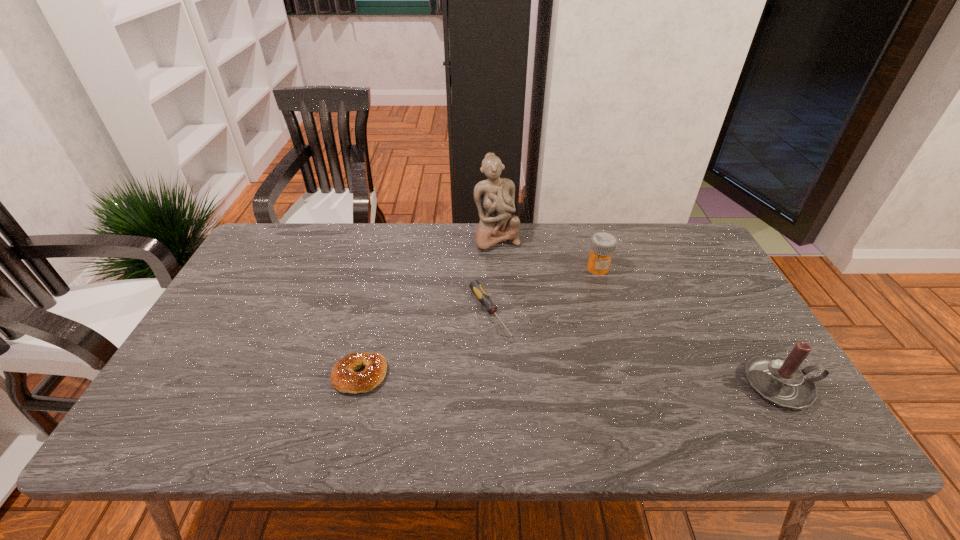
You are a GUI agent. You are given a task and a screenshot of the screen. Output one action in this format:
    pyautogui.click(x=<x>, y=<y>)
    Task: Click on the fourth tallest object
    
    Given the screenshot: What is the action you would take?
    pyautogui.click(x=343, y=378)

Identify the location of bagel. (343, 378).

Locate an element on the screen. candle is located at coordinates (780, 381).

Identify the location of the rightmost object. pos(780,381).

Where is `the third nearest object`? The image size is (960, 540). the third nearest object is located at coordinates (475, 286).

Where is `screwdriver`? The height and width of the screenshot is (540, 960). screwdriver is located at coordinates pyautogui.click(x=475, y=286).

This screenshot has width=960, height=540. In order to click on the tallest object in this screenshot , I will do `click(494, 197)`.

This screenshot has width=960, height=540. What are the coordinates of `figurine` in the screenshot? It's located at (494, 197).

You are a GUI agent. You are given a task and a screenshot of the screen. Output one action in this format:
    pyautogui.click(x=<x>, y=<y>)
    Task: Click on the second object from right to left
    The height and width of the screenshot is (540, 960).
    Given the screenshot: What is the action you would take?
    pyautogui.click(x=603, y=244)

Find the location of `the third shortest object`. the third shortest object is located at coordinates (603, 244).